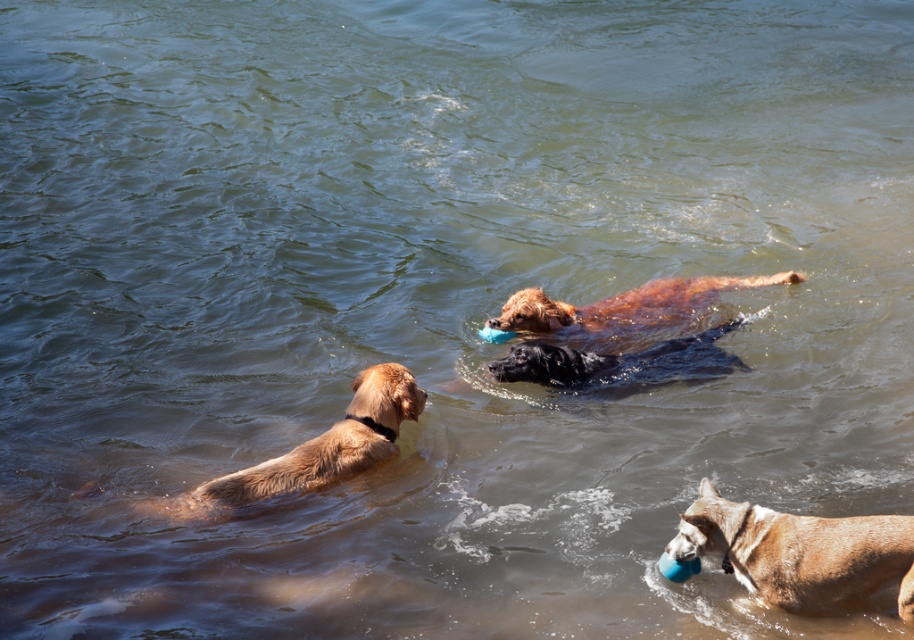
You are a photographer trying to capture the dogs in the water. You want to position your camera so that both the brown matte dog at lower right and the brown furry dog at center are in the frame. Based on their positions, which dog should you focus on first to ensure both are visible?

The brown matte dog at lower right is to the right of the brown furry dog at center, so you should focus on the brown furry dog at center first to ensure both are in the frame.

You are a photographer trying to capture the dogs in the water. You want to frame a shot that includes both the brown matte dog at lower right and the golden fur dog at left. Which dog should you position closer to the center of your camera frame to ensure both are visible without zooming in?

The golden fur dog at left is taller than the brown matte dog at lower right, so positioning the taller golden fur dog at left closer to the center will help balance the composition and ensure both are visible without zooming in.

You are standing on the shore of the lake and see the brown matte dog at lower right and the brown furry dog at center. Which dog is closer to you?

The brown matte dog at lower right is closer to you because it is in front of the brown furry dog at center.